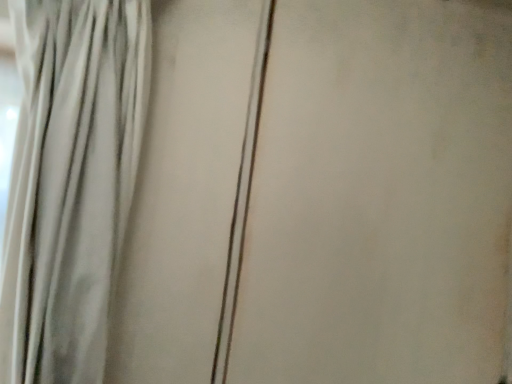
Where is `white silky curtain at left`? This screenshot has width=512, height=384. white silky curtain at left is located at coordinates (71, 182).

This screenshot has height=384, width=512. Describe the element at coordinates (71, 182) in the screenshot. I see `white silky curtain at left` at that location.

At what (x,y) coordinates should I click in order to perform the action: click on white silky curtain at left. Please return your answer as a coordinate pair (x, y). The height and width of the screenshot is (384, 512). Looking at the image, I should click on (71, 182).